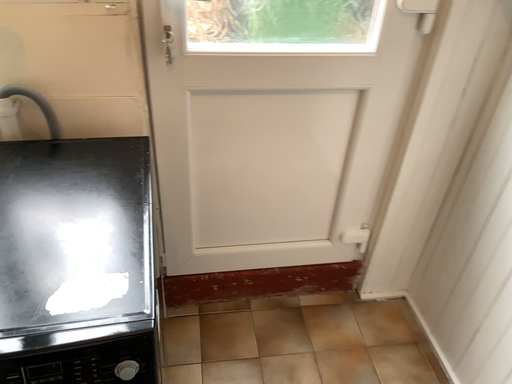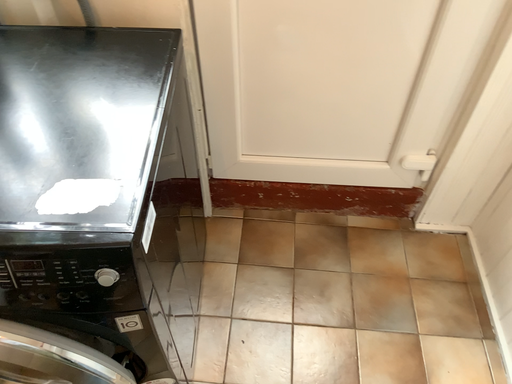
Question: Which way did the camera rotate in the video?

Choices:
 (A) rotated downward
 (B) rotated upward

Answer: (A)